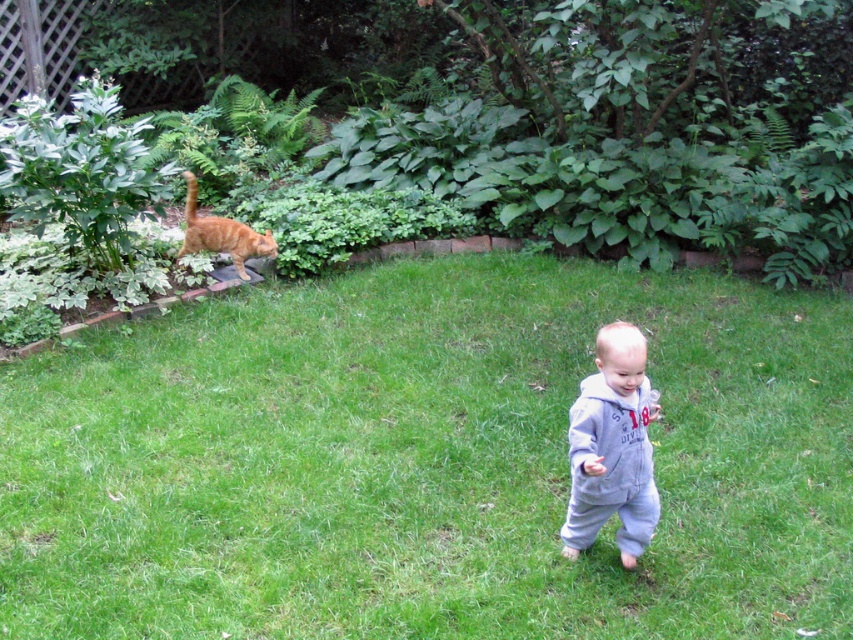
You are a drone operator trying to deliver a small package to the gray fleece onesie at center. The delivery coordinates are set to point [612,448]. Will the package land on the gray fleece onesie at center?

Yes, the package will land on the gray fleece onesie at center because the point [612,448] is on the gray fleece onesie at center.

You are a photographer trying to capture both the gray fleece onesie at center and the orange fur cat at upper left in the same frame. Based on their positions, which subject is closer to the camera?

The gray fleece onesie at center is closer to the camera because it is in front of the orange fur cat at upper left.

You are a photographer trying to capture a clear shot of the orange fur cat at upper left. However, the green grass at upper left is blocking your view. Can you adjust your position to see the cat without moving it?

Yes, since the green grass at upper left is in front of the orange fur cat at upper left, you can move your position slightly to the side or angle your camera so that the grass is no longer blocking the view of the cat.